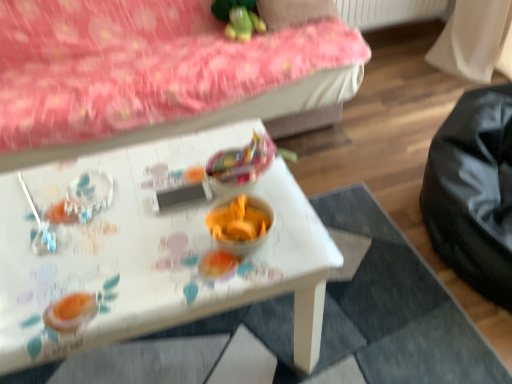
Locate an element on the screen. vacant space in front of shiny plastic candy at center is located at coordinates (232, 248).